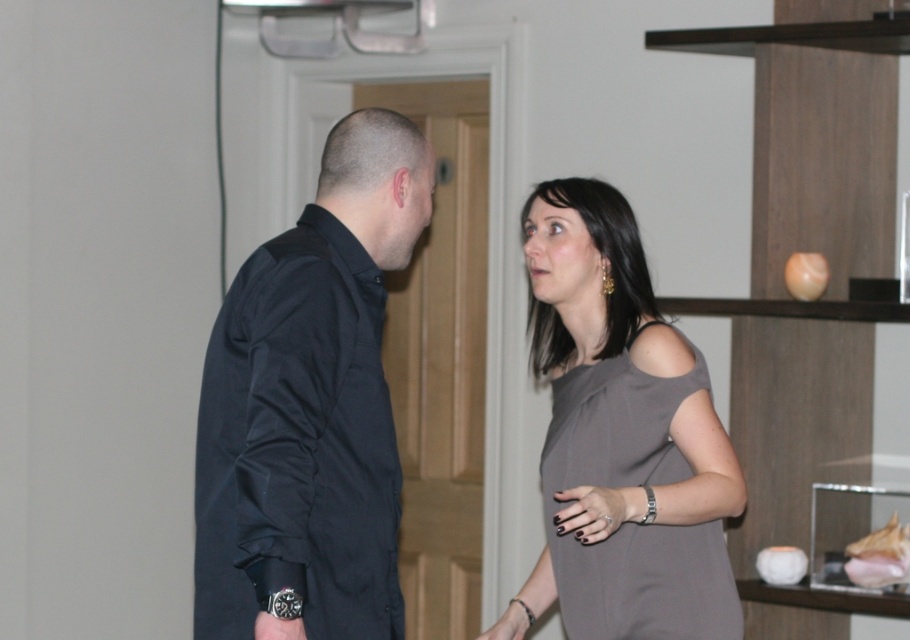
Question: Does black cotton shirt at left have a smaller size compared to gray matte dress at center?

Choices:
 (A) yes
 (B) no

Answer: (B)

Question: Which point appears farthest from the camera in this image?

Choices:
 (A) (219, 406)
 (B) (318, 609)
 (C) (639, 628)

Answer: (C)

Question: Which point appears closest to the camera in this image?

Choices:
 (A) (637, 410)
 (B) (367, 506)
 (C) (321, 458)

Answer: (C)

Question: Is black cotton shirt at left bigger than gray matte dress at center?

Choices:
 (A) yes
 (B) no

Answer: (A)

Question: Does black matte shirt at left have a larger size compared to black cotton shirt at left?

Choices:
 (A) no
 (B) yes

Answer: (A)

Question: Considering the real-world distances, which object is farthest from the black matte shirt at left?

Choices:
 (A) black cotton shirt at left
 (B) gray matte dress at center

Answer: (B)